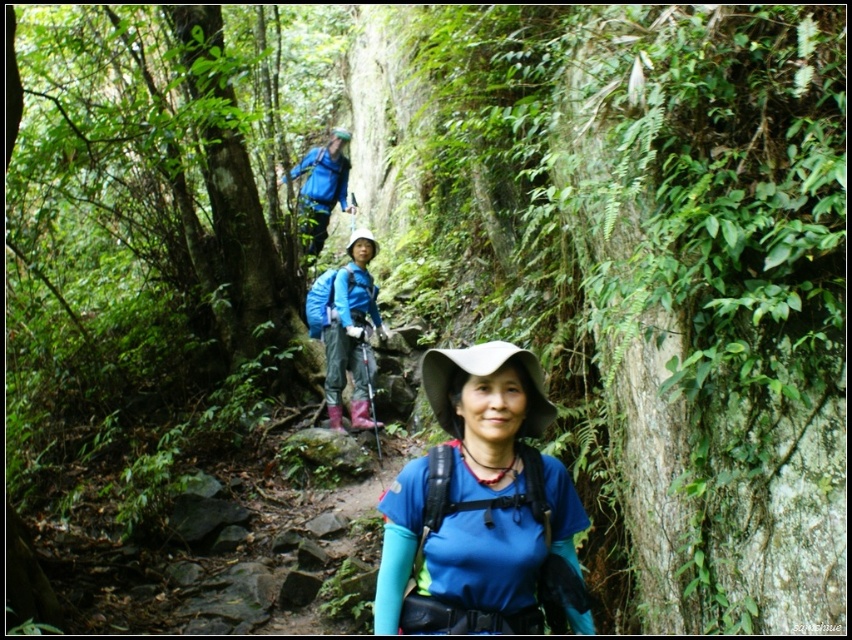
You are a hiker who wants to know which of the two blue items is smaller in size. The blue fabric shirt at center and the blue fabric jacket at upper center are both visible. Which one is smaller?

The blue fabric shirt at center is smaller than the blue fabric jacket at upper center.

You are a hiker who wants to take a photo of the blue fabric shirt at center and the green rough bark tree at left. Which object should you focus on first if you want to capture both in the same frame without moving the camera?

The green rough bark tree at left is positioned on the left side of blue fabric shirt at center, so you should focus on the blue fabric shirt at center first to ensure both are in the frame.

You are a hiker who wants to know which item of clothing has a larger width between the blue fabric shirt at center and the blue fabric jacket at upper center. Based on the scene, can you tell me which one is wider?

The blue fabric jacket at upper center has a larger width than the blue fabric shirt at center because the blue fabric shirt at center is narrower.